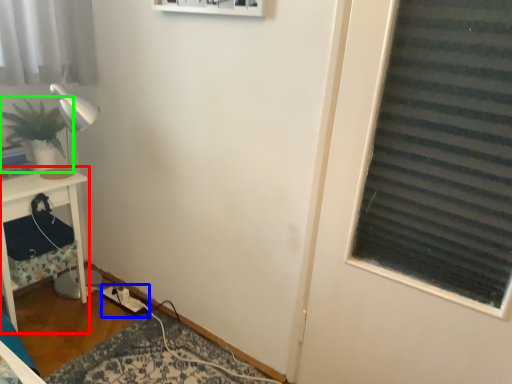
Question: Which object is positioned farthest from furniture (highlighted by a red box)? Select from extension cord (highlighted by a blue box) and houseplant (highlighted by a green box).

Choices:
 (A) extension cord
 (B) houseplant

Answer: (A)